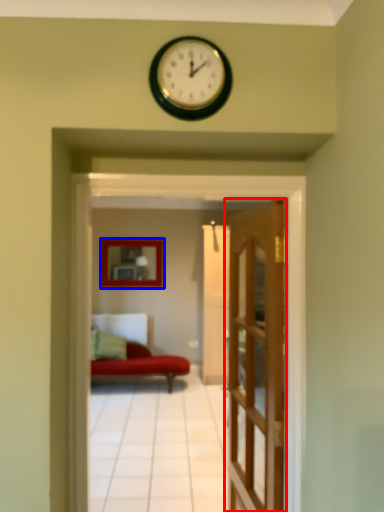
Question: Which object is further to the camera taking this photo, door (highlighted by a red box) or picture frame (highlighted by a blue box)?

Choices:
 (A) door
 (B) picture frame

Answer: (B)